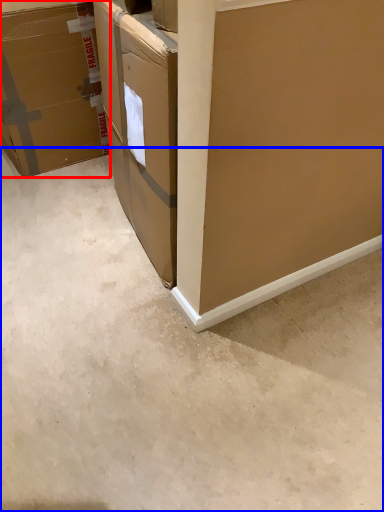
Question: Among these objects, which one is nearest to the camera, box (highlighted by a red box) or concrete (highlighted by a blue box)?

Choices:
 (A) box
 (B) concrete

Answer: (B)